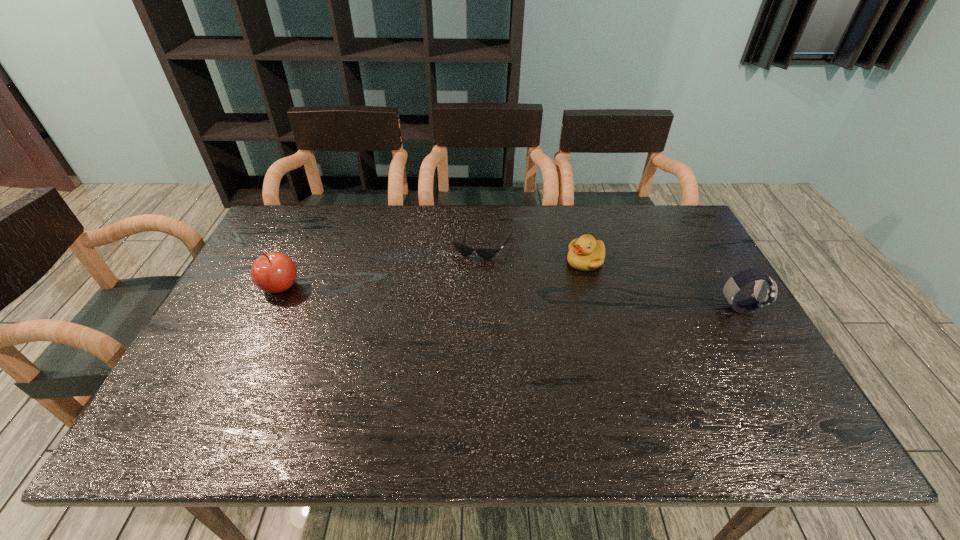
Where is `the leftmost object`? the leftmost object is located at coordinates (273, 272).

I want to click on watch, so click(x=765, y=290).

You are a GUI agent. You are given a task and a screenshot of the screen. Output one action in this format:
    pyautogui.click(x=<x>, y=<y>)
    Task: Click on the third tallest object
    
    Given the screenshot: What is the action you would take?
    pyautogui.click(x=585, y=253)

This screenshot has width=960, height=540. Identify the location of the second object from right to left. (585, 253).

Where is `the second object from left to right`? The width and height of the screenshot is (960, 540). the second object from left to right is located at coordinates (486, 253).

Image resolution: width=960 pixels, height=540 pixels. In order to click on the shortest object in this screenshot , I will do [x=486, y=253].

Where is `blank space located on the right of the leftmost object`? blank space located on the right of the leftmost object is located at coordinates (411, 286).

The height and width of the screenshot is (540, 960). Identify the location of vacant space located at the beak of the duckling. (519, 288).

Locate an element on the screen. The image size is (960, 540). vacant space located 0.270m at the beak of the duckling is located at coordinates (492, 299).

At what (x,y) coordinates should I click in order to perform the action: click on free space located 0.100m at the beak of the duckling. Please return your answer as a coordinate pair (x, y). This screenshot has height=540, width=960. Looking at the image, I should click on (542, 279).